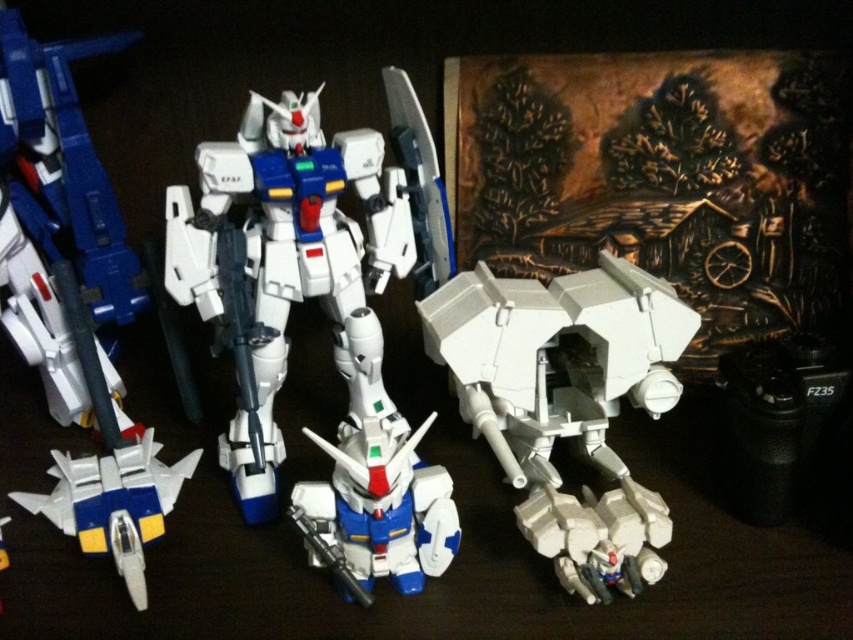
Question: Estimate the real-world distances between objects in this image. Which object is farther from the white plastic tank at center?

Choices:
 (A) white plastic jet at lower left
 (B) shiny white robot at center

Answer: (A)

Question: Which of the following is the closest to the observer?

Choices:
 (A) (152, 461)
 (B) (387, 433)

Answer: (B)

Question: Is white plastic tank at center thinner than white plastic jet at lower left?

Choices:
 (A) no
 (B) yes

Answer: (A)

Question: Which point is farther from the camera taking this photo?

Choices:
 (A) (131, 474)
 (B) (354, 132)
 (C) (511, 468)

Answer: (B)

Question: Does white plastic tank at center have a smaller size compared to white plastic jet at lower left?

Choices:
 (A) yes
 (B) no

Answer: (B)

Question: From the image, what is the correct spatial relationship of white plastic robot at center in relation to white plastic tank at center?

Choices:
 (A) below
 (B) above

Answer: (B)